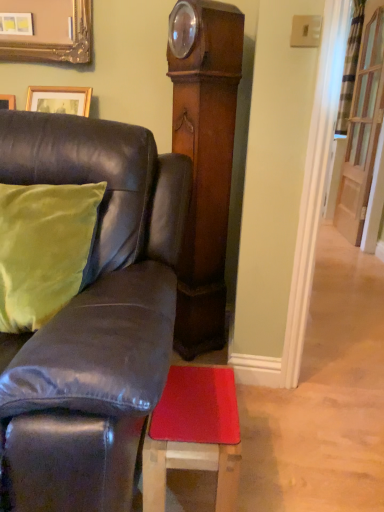
Locate an element on the screen. free spot in front of clear glass door at upper right is located at coordinates (340, 246).